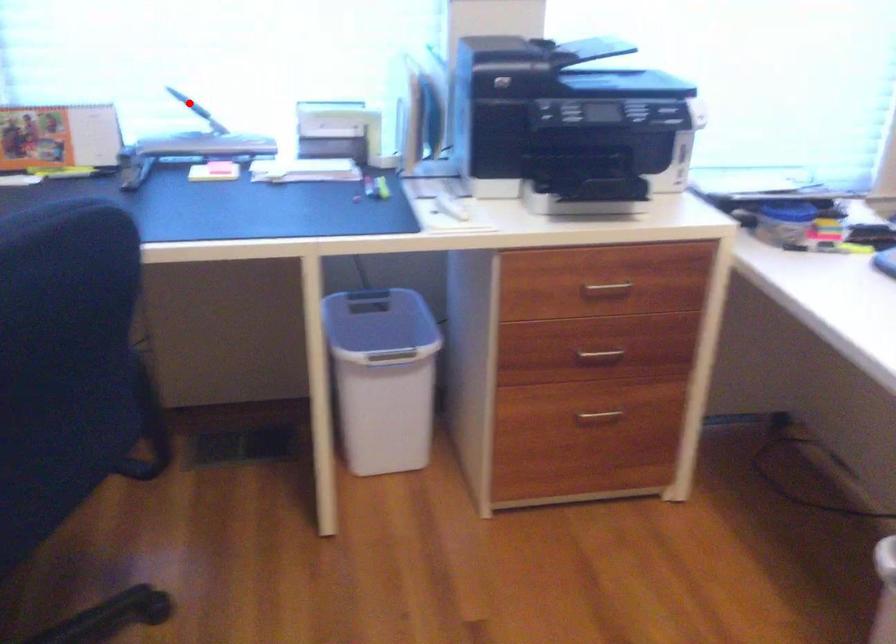
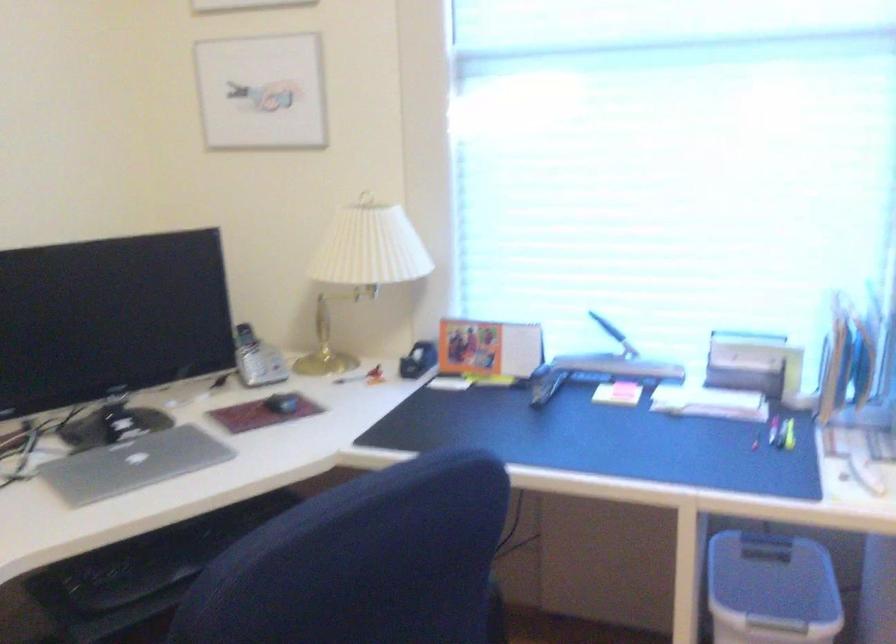
The point at the highlighted location is marked in the first image. Where is the corresponding point in the second image?

(607, 327)